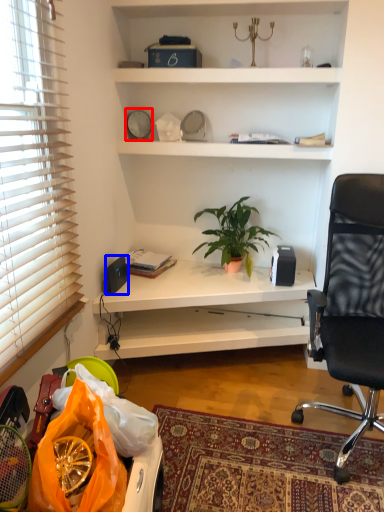
Question: Which object is closer to the camera taking this photo, clock (highlighted by a red box) or loudspeaker (highlighted by a blue box)?

Choices:
 (A) clock
 (B) loudspeaker

Answer: (B)